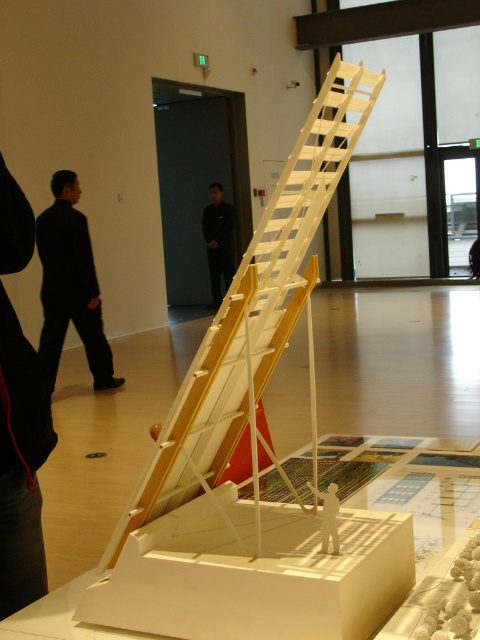
Based on the photo, you are standing in front of the architectural model and want to take a photo of the point at coordinate point (6, 385). If your camera can focus on objects within 5 feet, will it be able to capture the point clearly?

The distance of point (6, 385) from the camera is 4.33 feet, which is within the camera focus range of 5 feet. Therefore, the camera can capture the point clearly.

You are a visitor at the exhibition and want to take a photo of the model structure. You notice two black items on the left side of the pedestal. Which one is closer to you, the black fabric at left or the black suit at left?

The black fabric at left is closer to the viewer than the black suit at left.

You are an art curator planning to install a new exhibit. You need to place a 1.2 meter wide sculpture between the black fabric at left and the model structure. Is there enough space between them?

The position of black fabric at left is at point (x=21, y=464), but without knowing the position of the model structure, it is impossible to determine the distance between them. Please provide more information about the model structure.